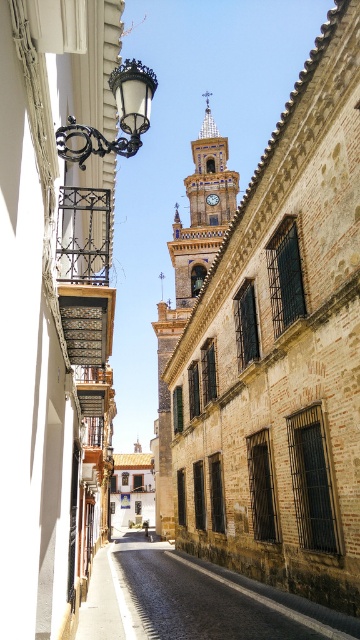
You are standing at the point marked as point (272, 342) in the image. Which building are you currently located on?

You are standing on the golden brick church at center because the point (272, 342) is located on it.

You are a tourist standing on the cobblestone street at center and want to take a photo of the golden stone clock tower at center. Which direction should you face to ensure the clock tower is in the background of your photo?

Since the cobblestone street at center is located below the golden stone clock tower at center, you should face upward to have the clock tower in the background of your photo.

You are a tourist standing at the entrance of the street and want to take a photo of both the golden brick church at center and the yellow brick tower at center. Given their positions, which one should you point your camera towards first to capture both in the frame?

You should point your camera towards the yellow brick tower at center first because the golden brick church at center is to the right of the yellow brick tower at center, so by centering the yellow brick tower at center, the golden brick church at center will naturally be included to its right in the frame.